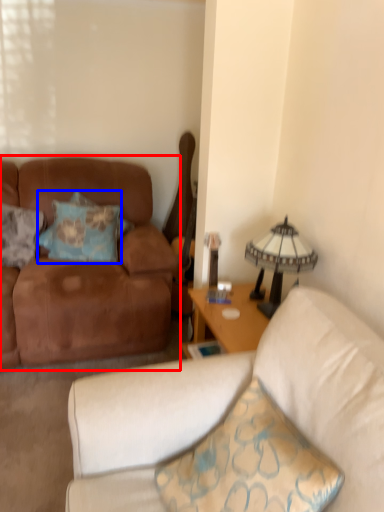
Question: Which of the following is the farthest to the observer, studio couch (highlighted by a red box) or pillow (highlighted by a blue box)?

Choices:
 (A) studio couch
 (B) pillow

Answer: (B)